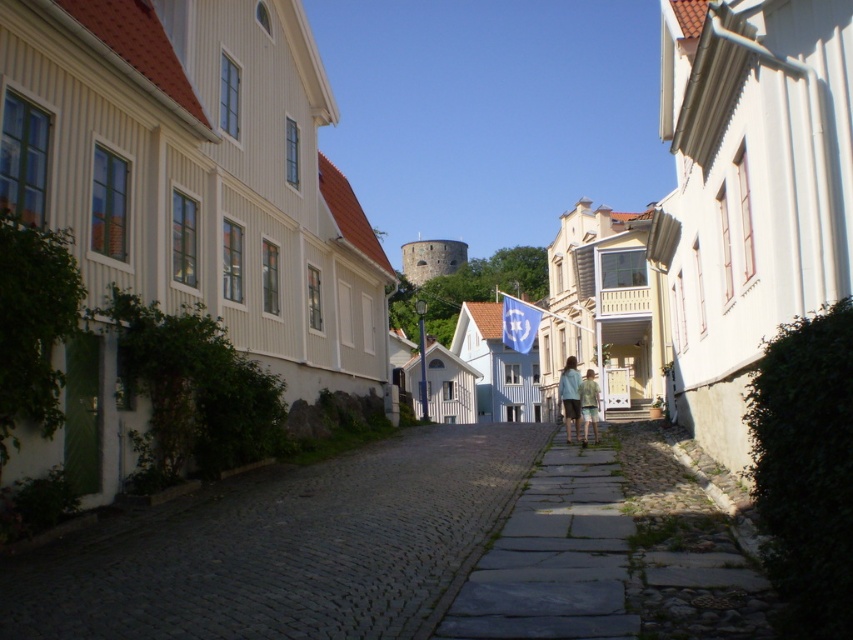
You are standing on the cobblestone street and want to walk towards the buildings. Which point, point [624,516] or point [567,401], is closer to you?

Point [624,516] is closer to the viewer than point [567,401], so you would reach point [624,516] first.